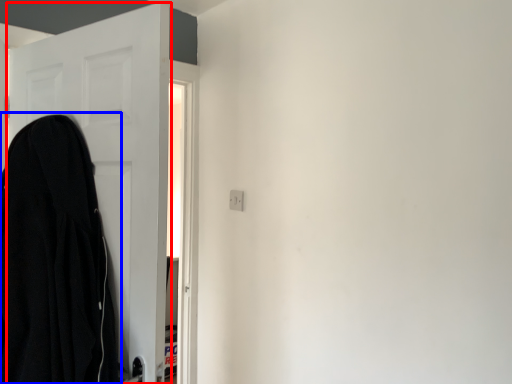
Question: Which object is closer to the camera taking this photo, door (highlighted by a red box) or cloak (highlighted by a blue box)?

Choices:
 (A) door
 (B) cloak

Answer: (B)